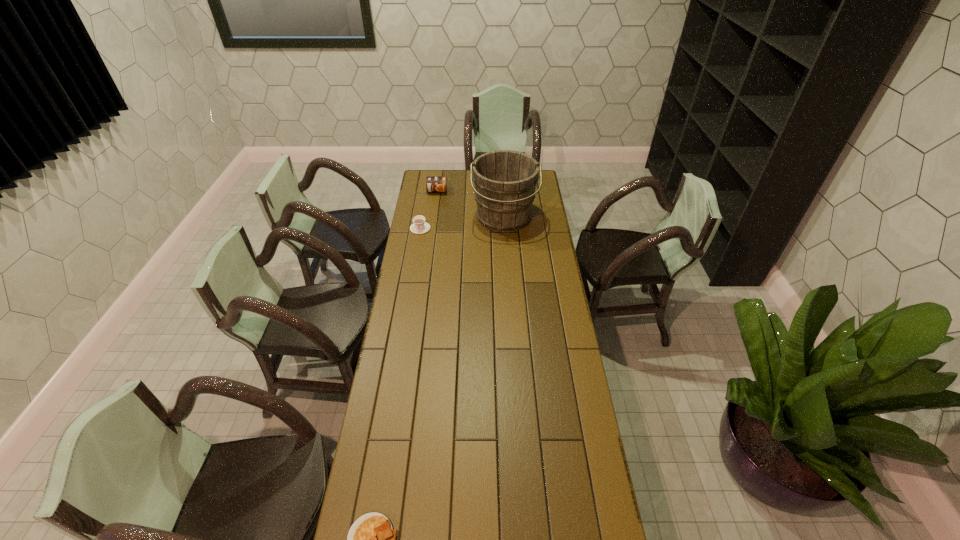
You are a GUI agent. You are given a task and a screenshot of the screen. Output one action in this format:
    pyautogui.click(x=<x>, y=<y>)
    Task: Click on the teacup that is at the left edge
    This screenshot has width=960, height=540.
    Given the screenshot: What is the action you would take?
    pyautogui.click(x=419, y=226)

Image resolution: width=960 pixels, height=540 pixels. Identify the location of object present at the right edge. (505, 180).

Where is `object present at the far left corner`? object present at the far left corner is located at coordinates (433, 183).

The width and height of the screenshot is (960, 540). Identify the location of vacant region at the far edge of the desktop. (461, 180).

Locate an element on the screen. This screenshot has width=960, height=540. free space at the left edge of the desktop is located at coordinates (428, 198).

Identify the location of free space at the right edge of the desktop. (550, 310).

Image resolution: width=960 pixels, height=540 pixels. In order to click on blank space at the far left corner in this screenshot , I will do `click(422, 189)`.

At what (x,y) coordinates should I click in order to perform the action: click on free point between the bucket and the can. Please return your answer as a coordinate pair (x, y). The image size is (960, 540). Looking at the image, I should click on point(470,205).

Locate an element on the screen. This screenshot has height=540, width=960. free space that is in between the bucket and the teacup is located at coordinates (462, 224).

At what (x,y) coordinates should I click in order to perform the action: click on free area in between the can and the rightmost object. Please return your answer as a coordinate pair (x, y). Image resolution: width=960 pixels, height=540 pixels. Looking at the image, I should click on (470, 205).